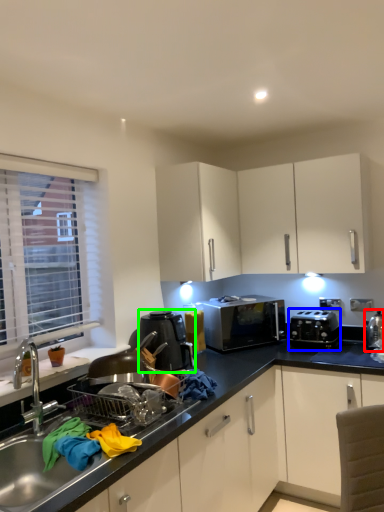
Question: Estimate the real-world distances between objects in this image. Which object is farther from appliance (highlighted by a red box), appliance (highlighted by a blue box) or kitchen appliance (highlighted by a green box)?

Choices:
 (A) appliance
 (B) kitchen appliance

Answer: (B)